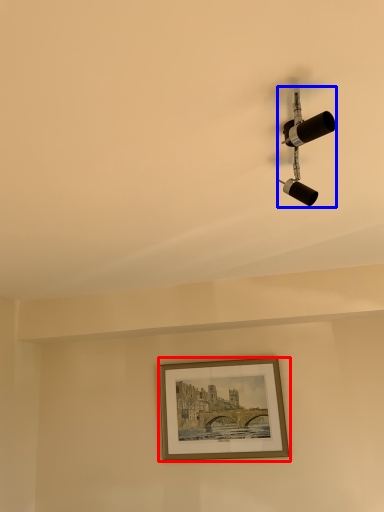
Question: Which point is further to the camera, picture frame (highlighted by a red box) or lamp (highlighted by a blue box)?

Choices:
 (A) picture frame
 (B) lamp

Answer: (A)